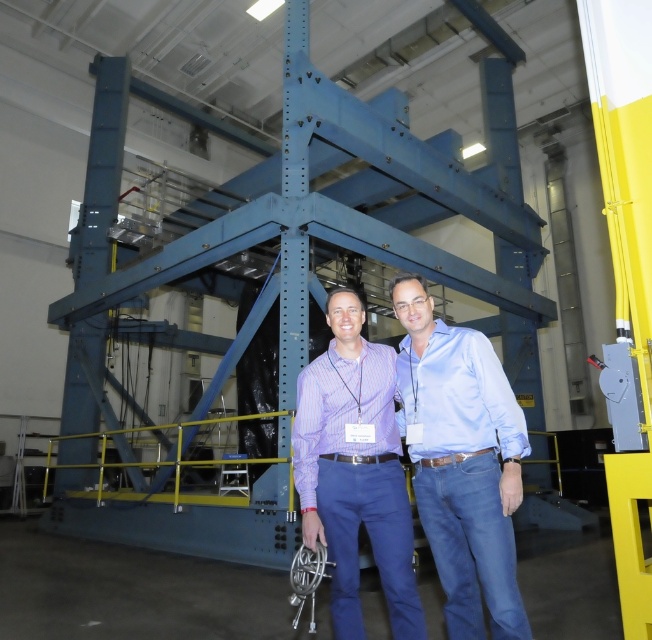
Question: Is blue jeans at center further to the viewer compared to purple checkered shirt at center?

Choices:
 (A) yes
 (B) no

Answer: (B)

Question: Which point appears farthest from the camera in this image?

Choices:
 (A) (454, 356)
 (B) (326, 420)

Answer: (B)

Question: Which of the following is the farthest from the observer?

Choices:
 (A) blue jeans at center
 (B) purple checkered shirt at center

Answer: (B)

Question: Does blue jeans at center lie behind purple checkered shirt at center?

Choices:
 (A) no
 (B) yes

Answer: (A)

Question: Does blue jeans at center have a larger size compared to purple checkered shirt at center?

Choices:
 (A) no
 (B) yes

Answer: (B)